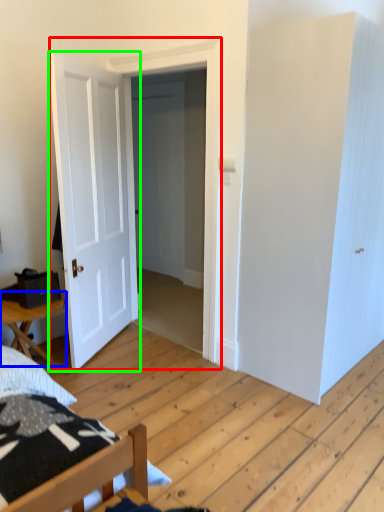
Question: Which object is positioned closest to door (highlighted by a red box)? Select from table (highlighted by a blue box) and door (highlighted by a green box).

Choices:
 (A) table
 (B) door

Answer: (B)